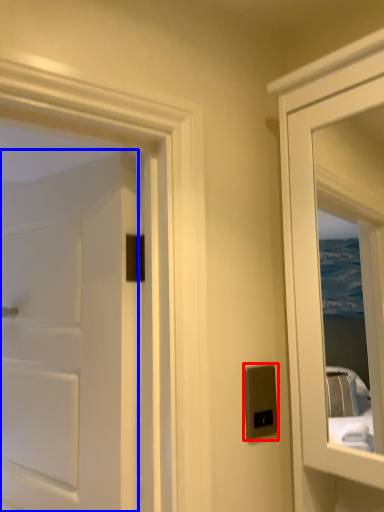
Question: Which object is closer to the camera taking this photo, electric outlet (highlighted by a red box) or door (highlighted by a blue box)?

Choices:
 (A) electric outlet
 (B) door

Answer: (B)